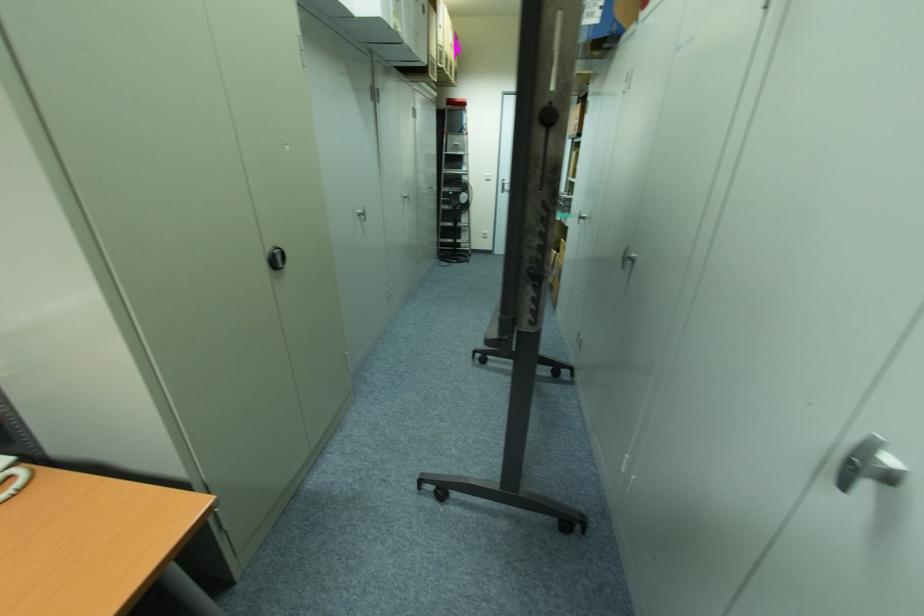
Find where to lift the white telephone handset. Please return your answer as a coordinate pair (x, y).

(13, 477)